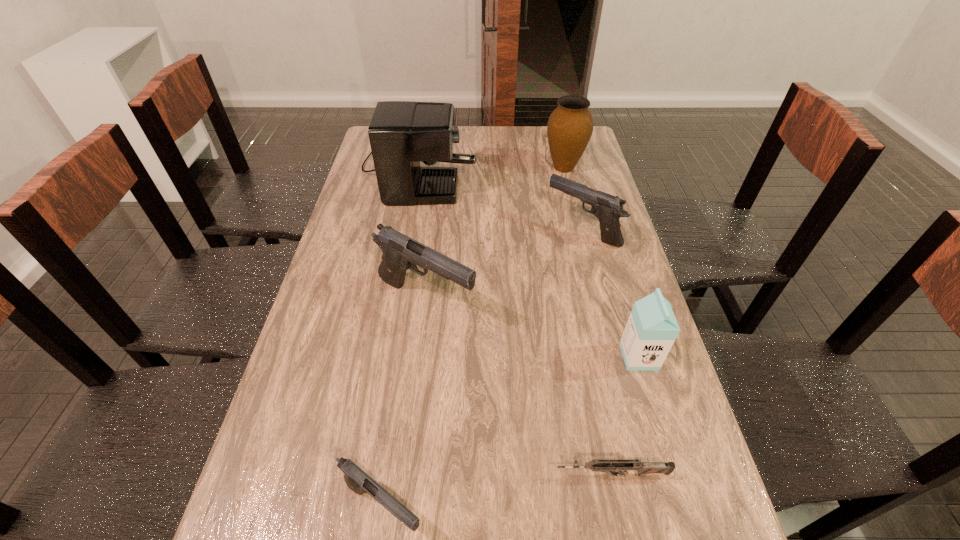
Image resolution: width=960 pixels, height=540 pixels. I want to click on black coffee maker, so click(402, 133).

Locate an element on the screen. This screenshot has width=960, height=540. brown urn is located at coordinates (569, 129).

You are a GUI agent. You are given a task and a screenshot of the screen. Output one action in this format:
    pyautogui.click(x=<x>, y=<y>)
    Task: Click on the biggest black gun
    
    Given the screenshot: What is the action you would take?
    pyautogui.click(x=400, y=252)

Where is `the second farthest gun`? This screenshot has height=540, width=960. the second farthest gun is located at coordinates (400, 252).

Identify the location of the fifth farthest object. The height and width of the screenshot is (540, 960). (651, 330).

Find the location of a particular element. milk carton is located at coordinates (651, 330).

Locate an element on the screen. This screenshot has width=960, height=540. the third shortest object is located at coordinates (608, 209).

Image resolution: width=960 pixels, height=540 pixels. What are the coordinates of `the farthest black gun` in the screenshot? It's located at (608, 209).

Locate an element on the screen. the shortest gun is located at coordinates (602, 465).

Where is `the shortest object`? The width and height of the screenshot is (960, 540). the shortest object is located at coordinates (602, 465).